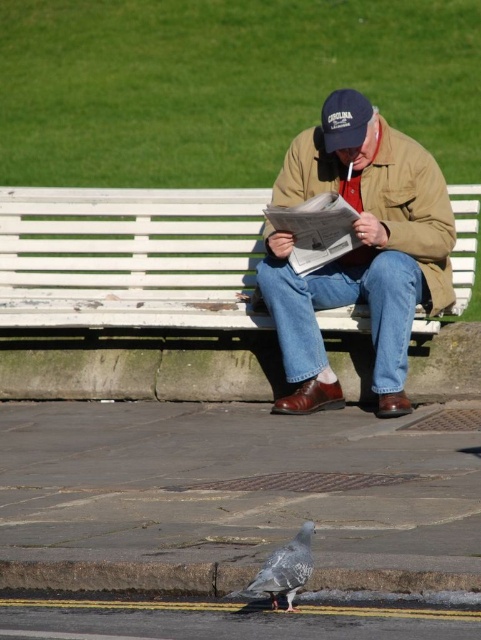
You are a photographer trying to capture both the tan leather jacket at center and the speckled gray pigeon at lower center in a single frame. Considering their sizes, which object should you focus on to ensure both are clearly visible in the photo?

The tan leather jacket at center is larger in size than the speckled gray pigeon at lower center, so focusing on the tan leather jacket at center would ensure both are clearly visible as the larger object will dominate the frame while the smaller pigeon can still be captured in detail.

Consider the image. You are a photographer trying to capture a closeup of the tan leather jacket at center and the speckled gray pigeon at lower center in the same frame. Based on their sizes, which object should you focus on first to ensure both are in focus?

The tan leather jacket at center has a greater height compared to the speckled gray pigeon at lower center, so you should focus on the tan leather jacket at center first to ensure both are in focus.